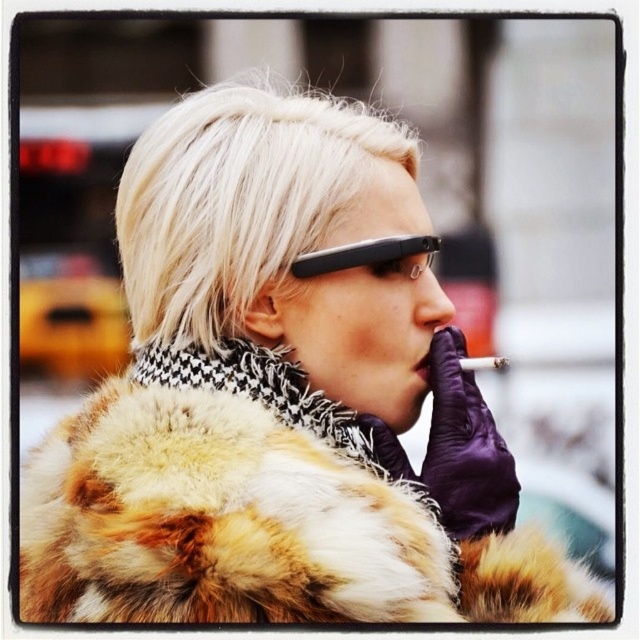
You are standing in the urban setting depicted in the image. You notice two points marked in the scene. The first point is at coordinates point (221, 244) and the second is at point (419, 236). Which point is closer to you?

Point (221, 244) is in front of point (419, 236), so the first point is closer to you.

You are a photographer trying to capture a closeup of the person in the scene. You notice the blonde fur at upper center and the black plastic glasses at upper center. Which object should you focus on first to ensure both are in sharp focus?

You should focus on the black plastic glasses at upper center first because it is closer to the viewer than the blonde fur at upper center. By focusing on the closer object, you can ensure both are within the depth of field.